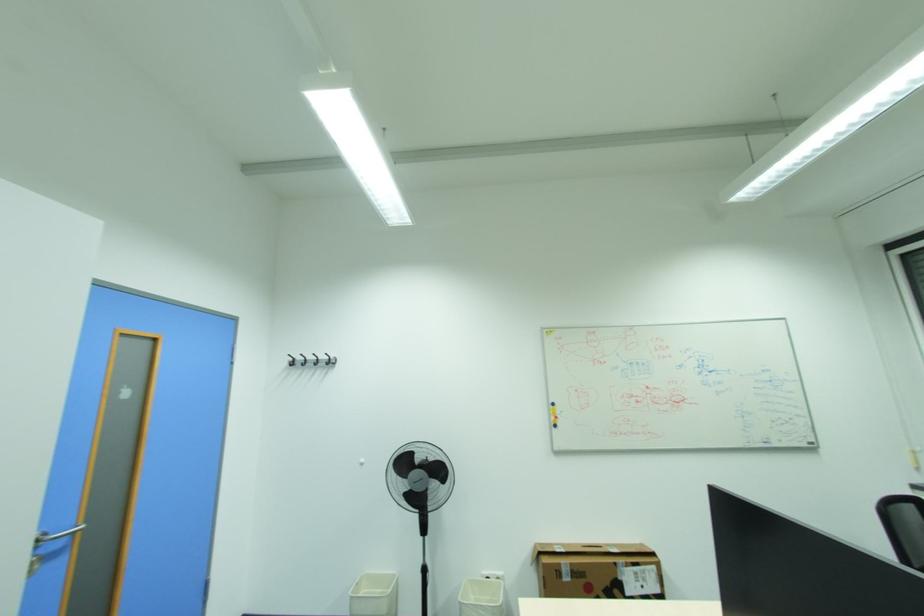
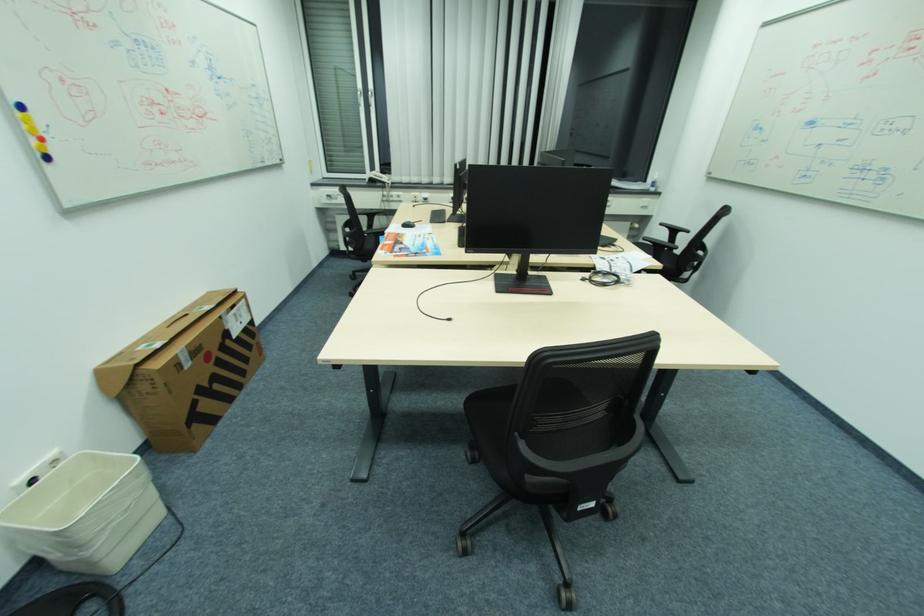
In the second image, find the point that corresponds to point 562,418 in the first image.

(44, 140)